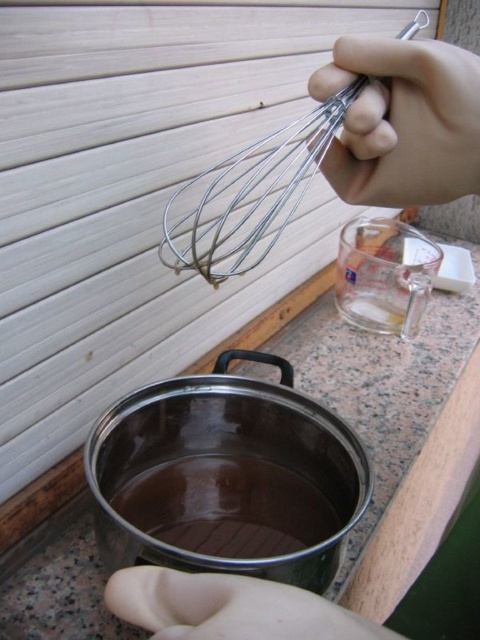
Question: Does metallic wire whisk at upper center appear on the right side of transparent glass liquid at center?

Choices:
 (A) yes
 (B) no

Answer: (A)

Question: Does metallic whisk at upper center have a lesser width compared to metallic wire whisk at upper center?

Choices:
 (A) yes
 (B) no

Answer: (A)

Question: Which object is positioned farthest from the metallic wire whisk at upper center?

Choices:
 (A) transparent glass liquid at center
 (B) skinny white hand at center

Answer: (B)

Question: Can you confirm if metallic whisk at upper center is positioned to the left of transparent glass liquid at center?

Choices:
 (A) no
 (B) yes

Answer: (A)

Question: Considering the real-world distances, which object is closest to the metallic wire whisk at upper center?

Choices:
 (A) skinny white hand at center
 (B) transparent glass liquid at center
 (C) metallic whisk at upper center

Answer: (C)

Question: Among these points, which one is farthest from the camera?

Choices:
 (A) (227, 532)
 (B) (285, 209)

Answer: (B)